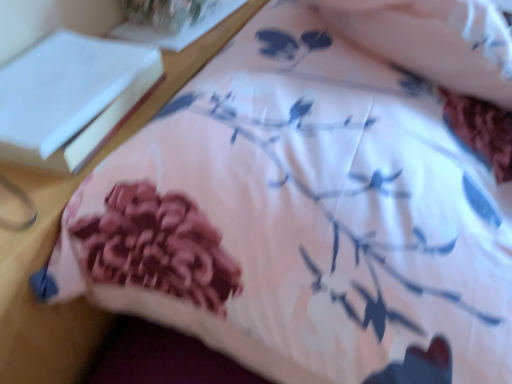
Question: Is white paper at upper left, acting as the 1th book starting from the back, not within white paper at upper left, the 2th book positioned from the back?

Choices:
 (A) yes
 (B) no

Answer: (A)

Question: From a real-world perspective, does white paper at upper left, which is the 1th book in top-to-bottom order, stand above white paper at upper left, acting as the 2th book starting from the top?

Choices:
 (A) no
 (B) yes

Answer: (A)

Question: Is white paper at upper left, which is counted as the second book, starting from the bottom, to the left of white paper at upper left, acting as the 2th book starting from the top, from the viewer's perspective?

Choices:
 (A) no
 (B) yes

Answer: (A)

Question: Is white paper at upper left, which is the 1th book in top-to-bottom order, positioned behind white paper at upper left, the first book when ordered from front to back?

Choices:
 (A) yes
 (B) no

Answer: (A)

Question: Is white paper at upper left, acting as the 1th book starting from the back, taller than white paper at upper left, acting as the 2th book starting from the top?

Choices:
 (A) yes
 (B) no

Answer: (B)

Question: Can you confirm if white paper at upper left, acting as the 1th book starting from the back, is smaller than white paper at upper left, the 2th book positioned from the back?

Choices:
 (A) no
 (B) yes

Answer: (B)

Question: Does white paper at upper left, acting as the first book starting from the bottom, have a larger size compared to white paper at upper left, which is the 1th book in top-to-bottom order?

Choices:
 (A) yes
 (B) no

Answer: (A)

Question: Could you tell me if white paper at upper left, the first book when ordered from front to back, is turned towards white paper at upper left, which is counted as the second book, starting from the bottom?

Choices:
 (A) yes
 (B) no

Answer: (B)

Question: Is white paper at upper left, acting as the 2th book starting from the top, not close to white paper at upper left, acting as the 1th book starting from the back?

Choices:
 (A) yes
 (B) no

Answer: (B)

Question: Does white paper at upper left, the 2th book positioned from the back, have a lesser width compared to white paper at upper left, which is counted as the second book, starting from the bottom?

Choices:
 (A) yes
 (B) no

Answer: (B)

Question: Is white paper at upper left, acting as the first book starting from the bottom, positioned beyond the bounds of white paper at upper left, which is counted as the second book, starting from the bottom?

Choices:
 (A) yes
 (B) no

Answer: (A)

Question: Is white paper at upper left, the first book when ordered from front to back, to the left of white paper at upper left, which appears as the 2th book when viewed from the front, from the viewer's perspective?

Choices:
 (A) no
 (B) yes

Answer: (B)

Question: Is white paper at upper left, the 2th book positioned from the back, inside or outside of white paper at upper left, which appears as the 2th book when viewed from the front?

Choices:
 (A) inside
 (B) outside

Answer: (B)